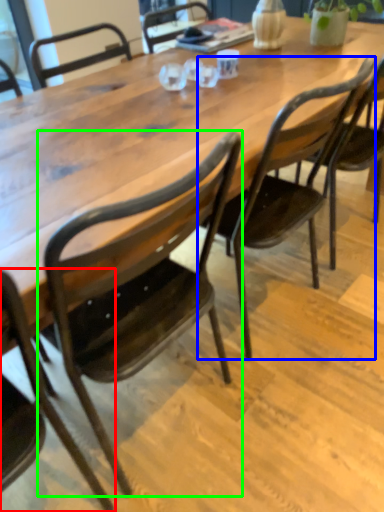
Question: Which is nearer to the chair (highlighted by a red box)? chair (highlighted by a blue box) or chair (highlighted by a green box).

Choices:
 (A) chair
 (B) chair

Answer: (B)